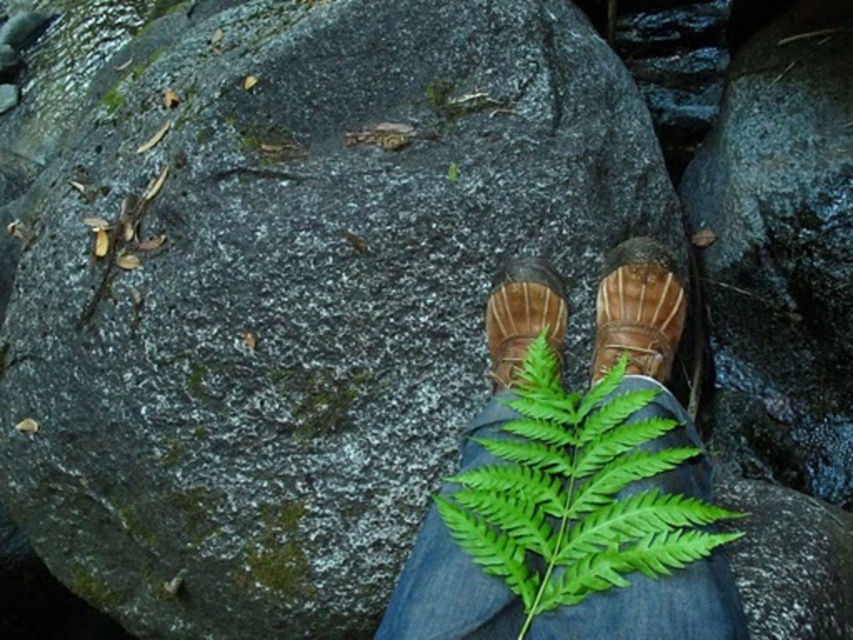
Is green leafy plant at center below brown suede shoe at center?

Yes.

Who is higher up, green leafy plant at center or brown suede shoe at center?

Positioned higher is brown suede shoe at center.

Where is `green leafy plant at center`? This screenshot has width=853, height=640. green leafy plant at center is located at coordinates (575, 483).

Does brown leather boot at center lie behind brown suede shoe at center?

No, brown leather boot at center is closer to the viewer.

Does brown leather boot at center have a larger size compared to brown suede shoe at center?

Indeed, brown leather boot at center has a larger size compared to brown suede shoe at center.

Is point (637, 324) behind point (519, 360)?

Yes, point (637, 324) is behind point (519, 360).

You are a GUI agent. You are given a task and a screenshot of the screen. Output one action in this format:
    pyautogui.click(x=<x>, y=<y>)
    Task: Click on the brown leather boot at center
    This screenshot has height=640, width=853.
    Given the screenshot: What is the action you would take?
    pyautogui.click(x=637, y=310)

Is green leafy plant at center positioned at the back of brown leather boot at center?

That is False.

Locate an element on the screen. green leafy plant at center is located at coordinates (575, 483).

Which is in front, point (508, 282) or point (630, 292)?

Positioned in front is point (630, 292).

Locate an element on the screen. This screenshot has width=853, height=640. green leafy plant at center is located at coordinates pyautogui.click(x=575, y=483).